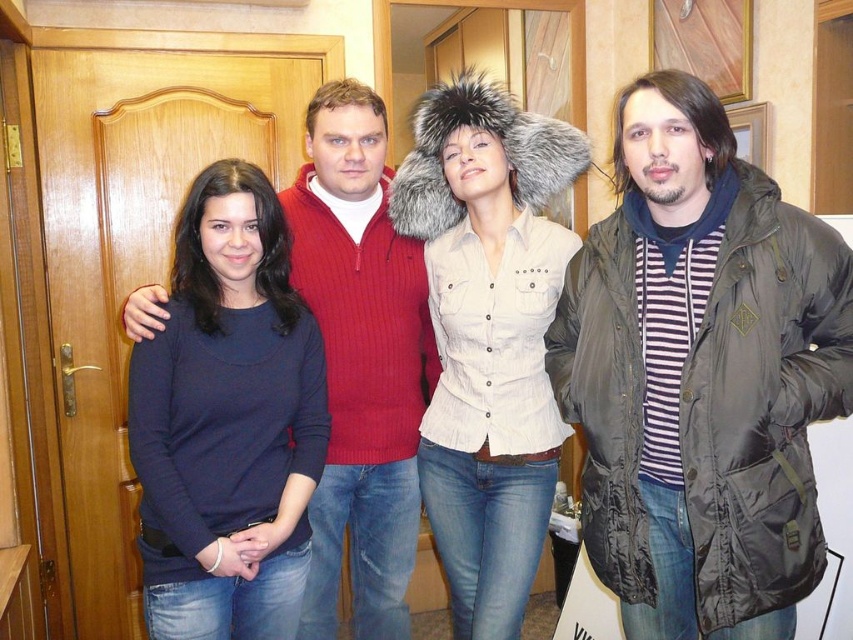
Question: Which of the following is the farthest from the observer?

Choices:
 (A) white cotton shirt at center
 (B) dark olive-green puffer jacket at right

Answer: (A)

Question: Estimate the real-world distances between objects in this image. Which object is farther from the dark blue sweater at center?

Choices:
 (A) white cotton shirt at center
 (B) dark olive-green puffer jacket at right

Answer: (B)

Question: Which point is farther from the camera taking this photo?

Choices:
 (A) (289, 620)
 (B) (642, 556)

Answer: (A)

Question: Observing the image, what is the correct spatial positioning of dark blue sweater at center in reference to white cotton shirt at center?

Choices:
 (A) below
 (B) above

Answer: (A)

Question: Does dark blue sweater at center have a lesser width compared to white cotton shirt at center?

Choices:
 (A) yes
 (B) no

Answer: (A)

Question: Is dark olive-green puffer jacket at right bigger than dark blue sweater at center?

Choices:
 (A) yes
 (B) no

Answer: (A)